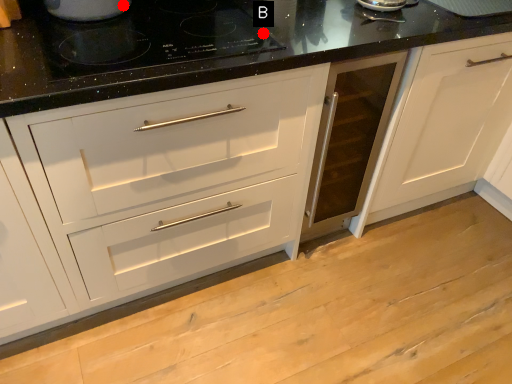
Question: Two points are circled on the image, labeled by A and B beside each circle. Which point appears closest to the camera in this image?

Choices:
 (A) A is closer
 (B) B is closer

Answer: (B)